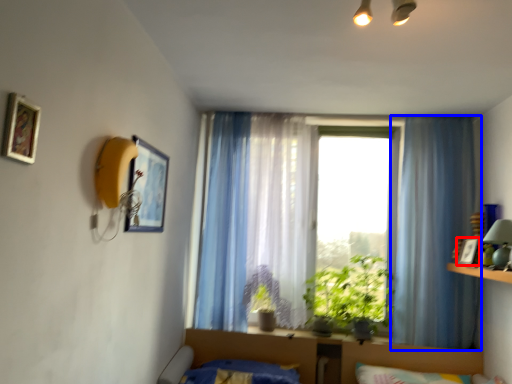
Question: Which of the following is the closest to the observer, picture frame (highlighted by a red box) or curtain (highlighted by a blue box)?

Choices:
 (A) picture frame
 (B) curtain

Answer: (A)